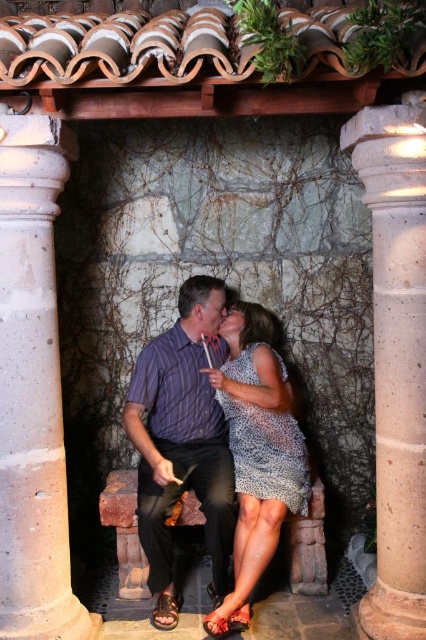
Question: Is printed fabric dress at center bigger than brown leather sandal at lower center?

Choices:
 (A) yes
 (B) no

Answer: (A)

Question: Does white speckled stone column at right lie behind purple striped shirt at center?

Choices:
 (A) no
 (B) yes

Answer: (A)

Question: Can you confirm if purple striped shirt at center is thinner than printed fabric dress at center?

Choices:
 (A) yes
 (B) no

Answer: (B)

Question: Considering the real-world distances, which object is closest to the concrete column at center?

Choices:
 (A) brown leather sandal at lower center
 (B) printed fabric dress at center

Answer: (A)

Question: Estimate the real-world distances between objects in this image. Which object is farther from the printed fabric dress at center?

Choices:
 (A) purple striped shirt at center
 (B) brown leather sandal at lower center
 (C) white speckled stone column at right
 (D) concrete column at center

Answer: (D)

Question: Which point is farther to the camera?

Choices:
 (A) white speckled stone column at right
 (B) printed fabric dress at center
 (C) concrete column at center

Answer: (B)